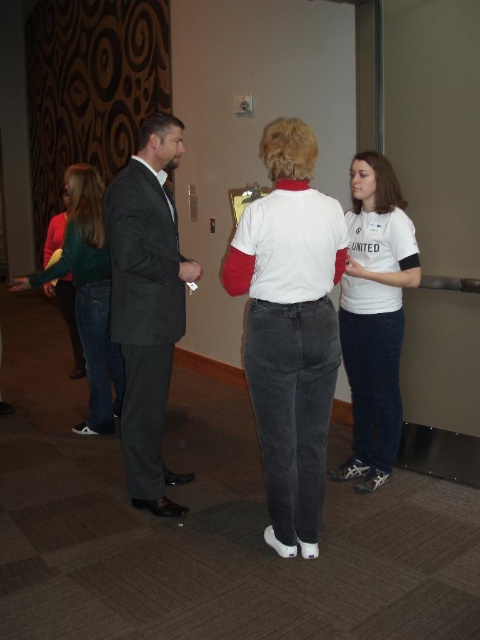
You are an observer in the scene. You notice a blonde synthetic wig at center and a dark brown hair at upper left. Which object is positioned lower in the image?

The blonde synthetic wig at center is positioned below the dark brown hair at upper left, so it is lower in the image.

You are a photographer setting up for a group photo. You need to ensure that all subjects are visible. Given the positions of the blonde synthetic wig at center and the dark brown hair at upper left, which one might partially obscure the other if they are positioned closer to the camera? Please explain based on their heights.

The blonde synthetic wig at center has a greater height compared to dark brown hair at upper left. Since it is taller, the blonde synthetic wig at center could potentially obscure the view of the dark brown hair at upper left if positioned closer to the camera.